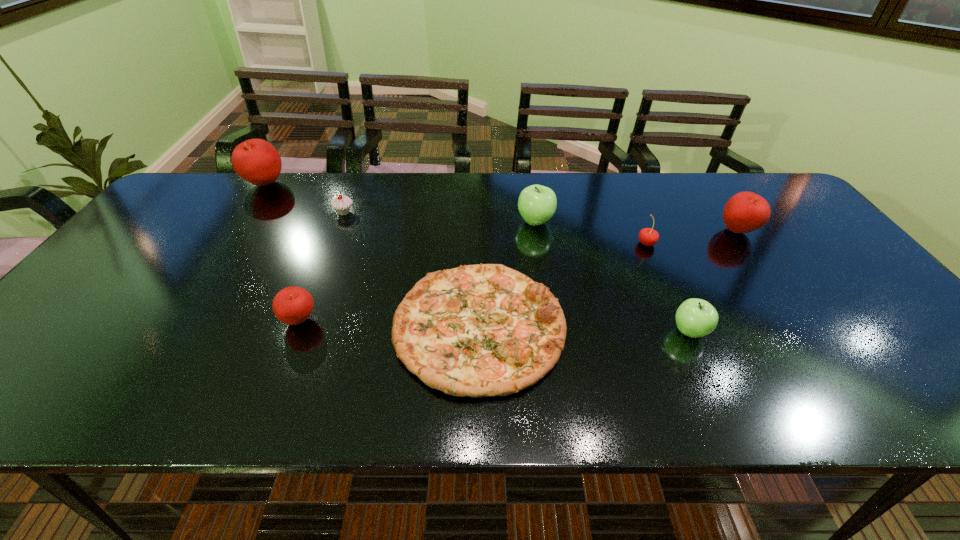
Find the location of a particular element. unoccupied position between the rightmost object and the cherry is located at coordinates (692, 237).

You are a GUI agent. You are given a task and a screenshot of the screen. Output one action in this format:
    pyautogui.click(x=<x>, y=<y>)
    Task: Click on the free space between the brown pizza and the rightmost object
    This screenshot has height=540, width=960.
    Given the screenshot: What is the action you would take?
    pyautogui.click(x=609, y=279)

Image resolution: width=960 pixels, height=540 pixels. I want to click on vacant point located between the third apple from left to right and the rightmost red apple, so click(x=636, y=226).

At what (x,y) coordinates should I click in order to perform the action: click on free space that is in between the pizza and the nearest red apple. Please return your answer as a coordinate pair (x, y). The width and height of the screenshot is (960, 540). Looking at the image, I should click on (390, 324).

At what (x,y) coordinates should I click in order to perform the action: click on vacant area between the right green apple and the farther green apple. Please return your answer as a coordinate pair (x, y). Image resolution: width=960 pixels, height=540 pixels. Looking at the image, I should click on (612, 276).

Choose which object is the sixth nearest neighbor to the farthest red apple. Please provide its 2D coordinates. Your answer should be formatted as a tuple, i.e. [(x, y)], where the tuple contains the x and y coordinates of a point satisfying the conditions above.

[(695, 318)]

Choose which object is the fifth nearest neighbor to the red cherry. Please provide its 2D coordinates. Your answer should be formatted as a tuple, i.e. [(x, y)], where the tuple contains the x and y coordinates of a point satisfying the conditions above.

[(342, 204)]

Select which apple appears as the closest to the bigger green apple. Please provide its 2D coordinates. Your answer should be formatted as a tuple, i.e. [(x, y)], where the tuple contains the x and y coordinates of a point satisfying the conditions above.

[(695, 318)]

Identify the location of apple identified as the third closest to the second apple from right to left. (293, 305).

Point out which red apple is positioned as the second nearest to the right green apple. Please provide its 2D coordinates. Your answer should be formatted as a tuple, i.e. [(x, y)], where the tuple contains the x and y coordinates of a point satisfying the conditions above.

[(293, 305)]